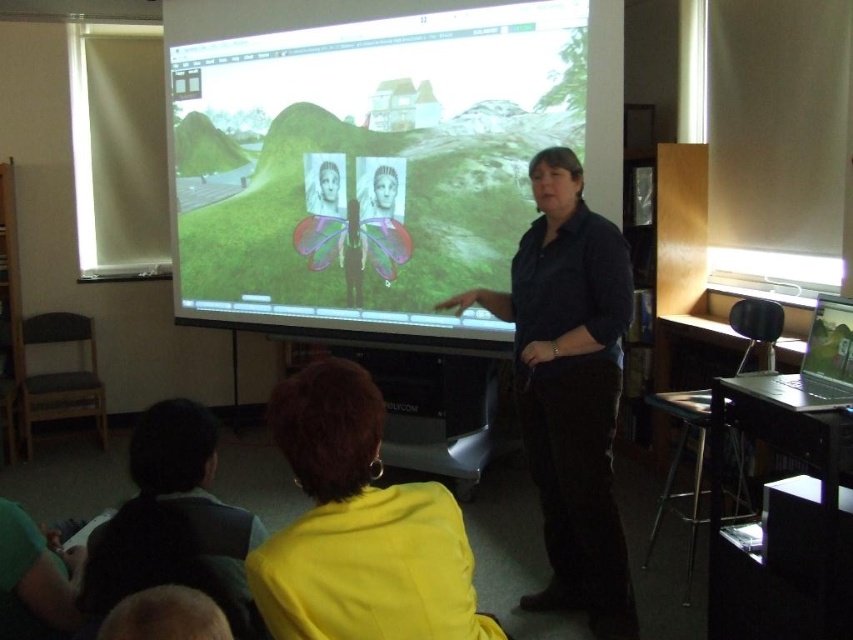
You are sitting in the classroom and want to see the matte white screen at center clearly. The recommended viewing distance for this screen is 10 feet. Is the screen within the recommended distance?

The matte white screen at center is 10.80 feet away from the viewer, which is slightly beyond the recommended 10 feet viewing distance. Therefore, the screen is not within the recommended distance.

You are an attendee in the classroom and want to see both the matte white screen at center and the dark blue shirt at center clearly. Which one is located in front from your perspective?

The dark blue shirt at center is located behind the matte white screen at center, so the matte white screen at center is in front.